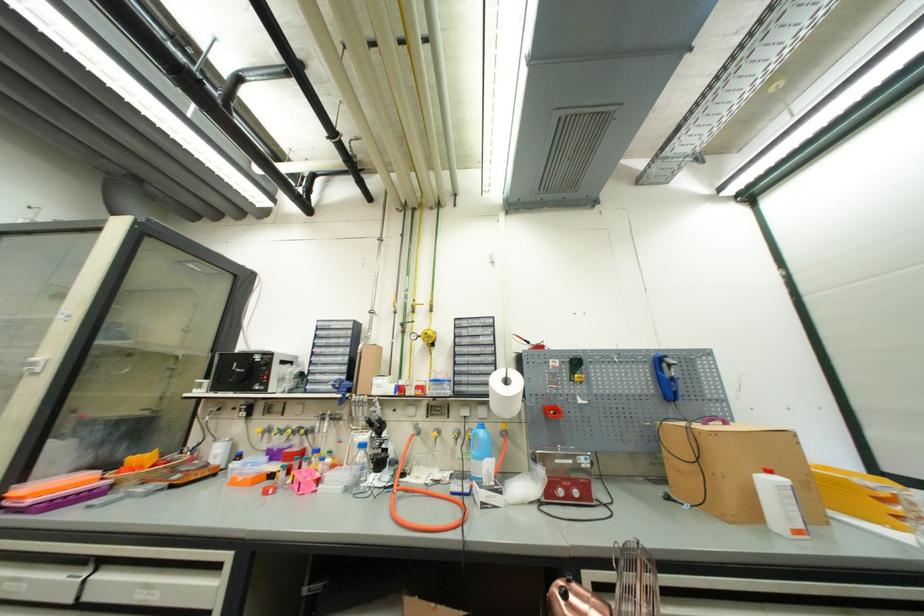
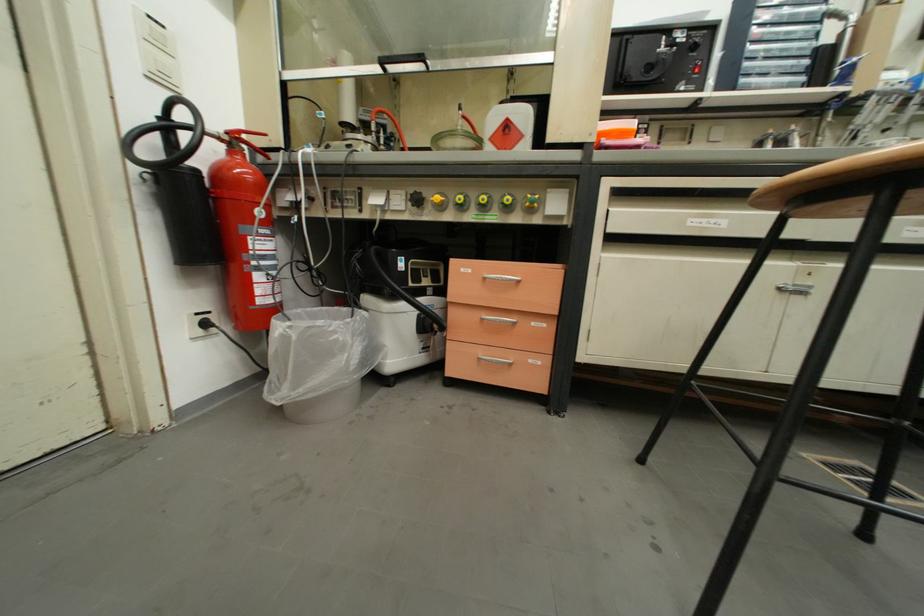
Question: The images are taken continuously from a first-person perspective. In which direction are you moving?

Choices:
 (A) Left
 (B) Right
 (C) Forward
 (D) Backward

Answer: (A)